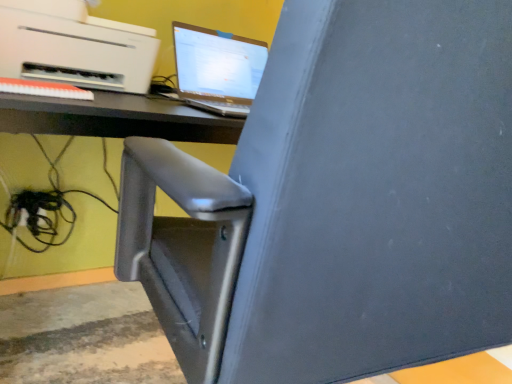
This screenshot has height=384, width=512. Find the location of `white matte printer at upper left`. white matte printer at upper left is located at coordinates (74, 46).

The height and width of the screenshot is (384, 512). Describe the element at coordinates (74, 46) in the screenshot. I see `white matte printer at upper left` at that location.

Where is `white matte printer at upper left`? The image size is (512, 384). white matte printer at upper left is located at coordinates (74, 46).